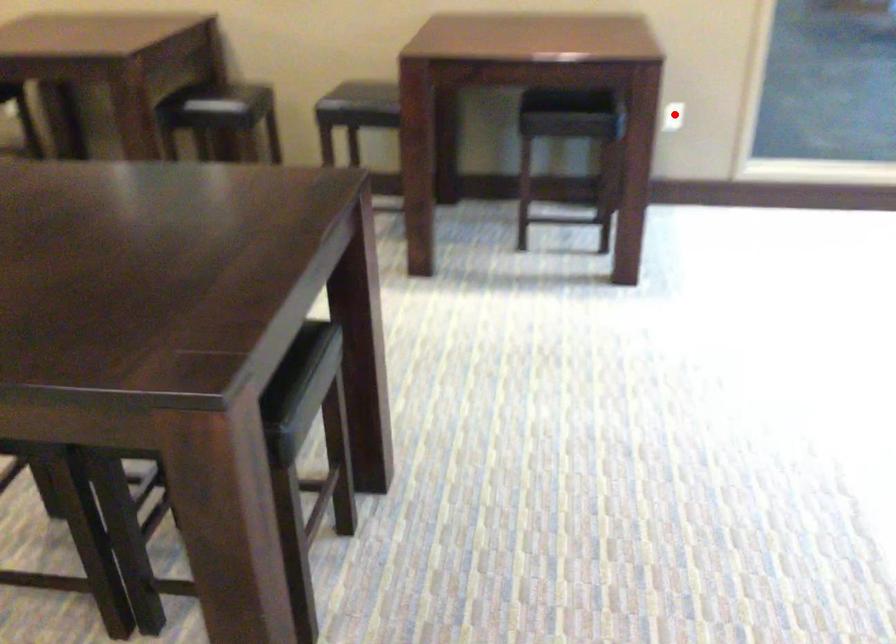
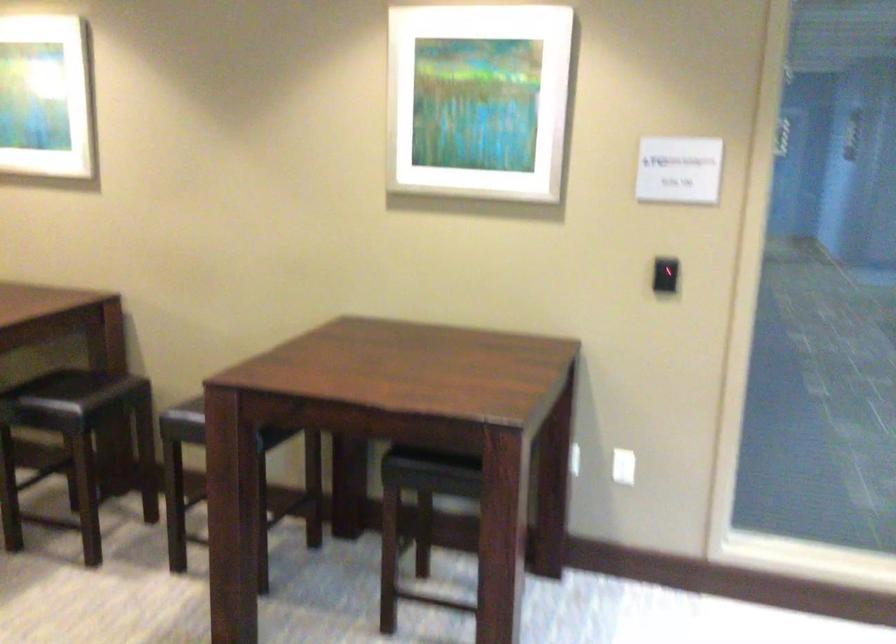
Find the pixel in the second image that matches the highlighted location in the first image.

(623, 466)